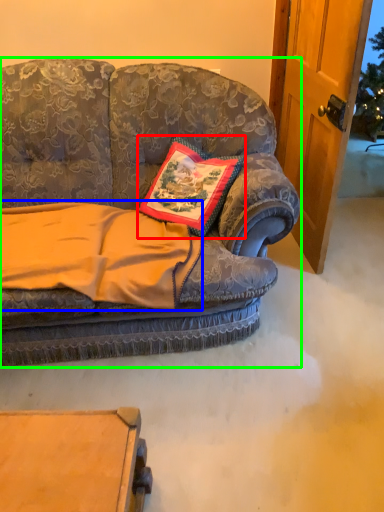
Question: Estimate the real-world distances between objects in this image. Which object is closer to pillow (highlighted by a red box), blanket (highlighted by a blue box) or studio couch (highlighted by a green box)?

Choices:
 (A) blanket
 (B) studio couch

Answer: (B)